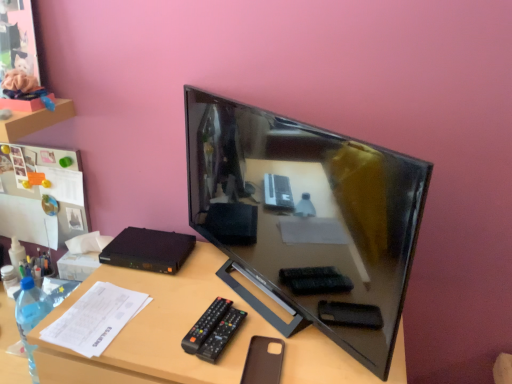
Question: Is point (98, 339) positioned closer to the camera than point (248, 360)?

Choices:
 (A) farther
 (B) closer

Answer: (A)

Question: From the image's perspective, is white paper at lower left located above or below brown leather phone case at lower center?

Choices:
 (A) below
 (B) above

Answer: (B)

Question: Considering the real-world distances, which object is closest to the brown leather phone case at lower center?

Choices:
 (A) black glossy television at center
 (B) white paper at lower left
 (C) black plastic remote at lower center
 (D) brown matte desk at center

Answer: (C)

Question: Estimate the real-world distances between objects in this image. Which object is farther from the black glossy television at center?

Choices:
 (A) white paper at lower left
 (B) brown matte desk at center
 (C) brown leather phone case at lower center
 (D) black plastic remote at lower center

Answer: (A)